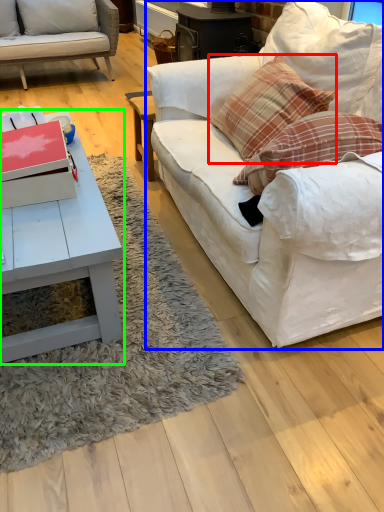
Question: Which is farther away from pillow (highlighted by a red box)? studio couch (highlighted by a blue box) or coffee table (highlighted by a green box)?

Choices:
 (A) studio couch
 (B) coffee table

Answer: (B)